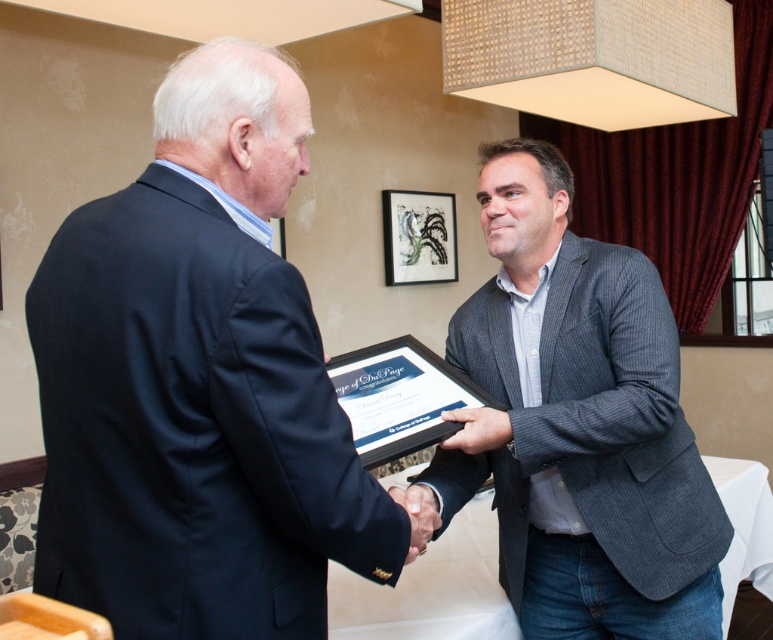
Does gray corduroy blazer at center have a larger size compared to smooth black hand at center?

Correct, gray corduroy blazer at center is larger in size than smooth black hand at center.

In the scene shown: Does gray corduroy blazer at center appear on the left side of smooth black hand at center?

Incorrect, gray corduroy blazer at center is not on the left side of smooth black hand at center.

At what (x,y) coordinates should I click in order to perform the action: click on gray corduroy blazer at center. Please return your answer as a coordinate pair (x, y). This screenshot has height=640, width=773. Looking at the image, I should click on (581, 422).

Locate an element on the screen. gray corduroy blazer at center is located at coordinates (581, 422).

Is matte black hand at center positioned before smooth black hand at center?

No.

Where is `matte black hand at center`? matte black hand at center is located at coordinates (477, 429).

Does dark blue suit at center lie in front of matte black hand at center?

Yes.

Measure the distance between point (220, 145) and camera.

The distance of point (220, 145) from camera is 1.00 meters.

Locate an element on the screen. The image size is (773, 640). dark blue suit at center is located at coordinates (198, 381).